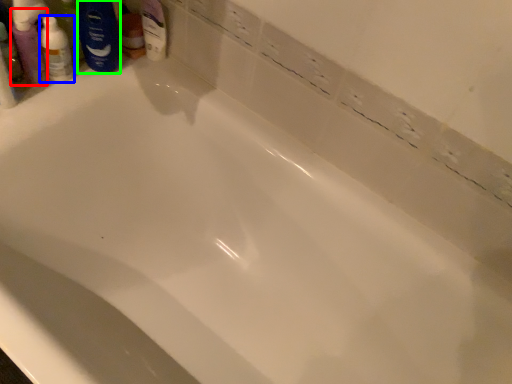
Question: Which is farther away from mouthwash (highlighted by a red box)? toiletry (highlighted by a blue box) or shaving cream (highlighted by a green box)?

Choices:
 (A) toiletry
 (B) shaving cream

Answer: (B)